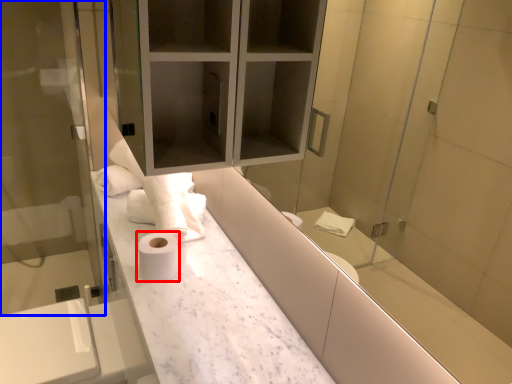
Question: Which object appears farthest to the camera in this image, toilet paper (highlighted by a red box) or screen door (highlighted by a blue box)?

Choices:
 (A) toilet paper
 (B) screen door

Answer: (B)